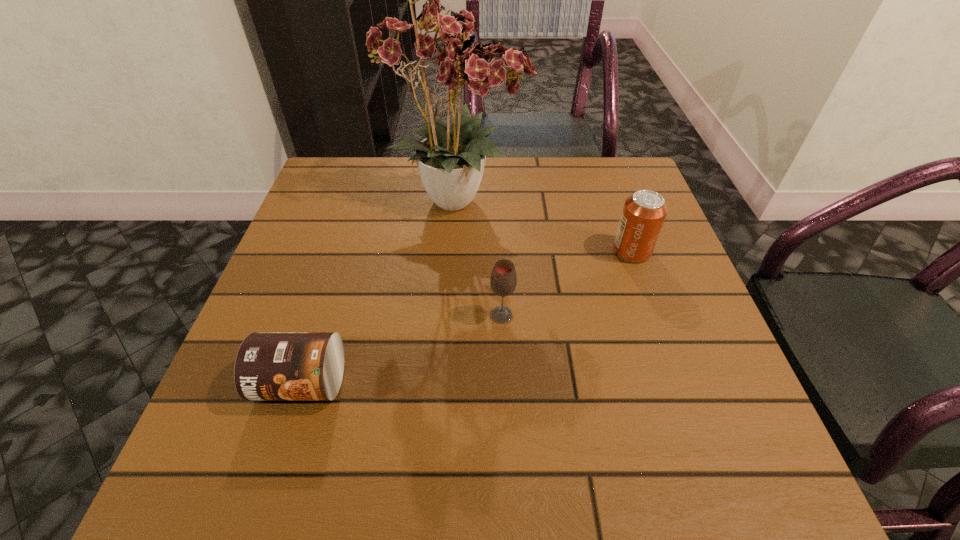
I want to click on flower arrangement, so click(x=443, y=50).

This screenshot has height=540, width=960. I want to click on the farthest object, so click(443, 50).

At what (x,y) coordinates should I click in order to perform the action: click on the taller can. Please return your answer as a coordinate pair (x, y). Looking at the image, I should click on (644, 212).

Identify the location of the third nearest object. (644, 212).

Image resolution: width=960 pixels, height=540 pixels. I want to click on glass drink container, so click(503, 281).

I want to click on the nearest object, so click(269, 365).

At what (x,y) coordinates should I click in order to perform the action: click on the nearer can. Please return your answer as a coordinate pair (x, y). The width and height of the screenshot is (960, 540). Looking at the image, I should click on [269, 365].

The width and height of the screenshot is (960, 540). Identify the location of free space located on the front-facing side of the flower arrangement. (605, 199).

Locate an element on the screen. This screenshot has height=540, width=960. blank space located on the left of the second farthest object is located at coordinates (470, 251).

At what (x,y) coordinates should I click in order to perform the action: click on free spot located 0.150m on the front of the third farthest object. Please return your answer as a coordinate pair (x, y). The height and width of the screenshot is (540, 960). Looking at the image, I should click on (505, 398).